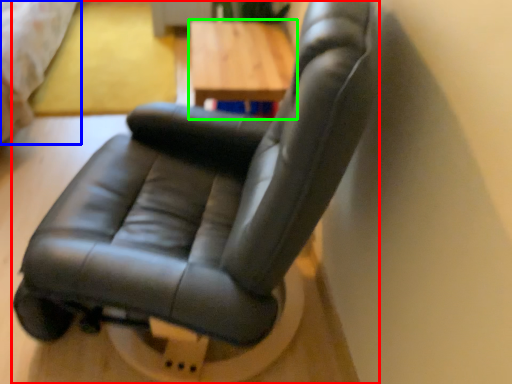
Question: Which object is the farthest from chair (highlighted by a red box)? Choose among these: bed (highlighted by a blue box) or table (highlighted by a green box).

Choices:
 (A) bed
 (B) table

Answer: (A)